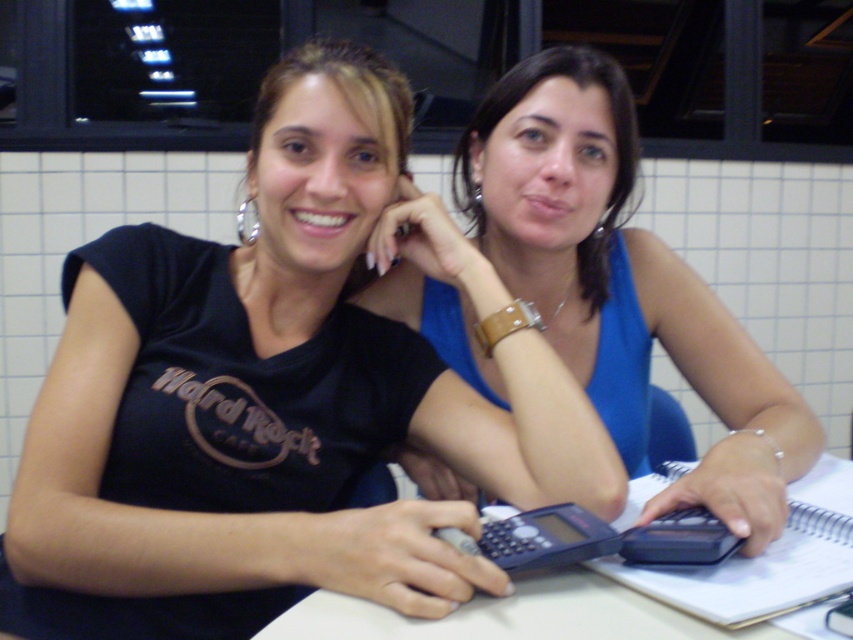
Question: Can you confirm if black matte calculator at center is thinner than spiral-bound paper at center?

Choices:
 (A) no
 (B) yes

Answer: (A)

Question: Considering the real-world distances, which object is closest to the spiral-bound paper at center?

Choices:
 (A) black matte calculator at center
 (B) white plastic table at center
 (C) blue fabric tank top at center

Answer: (B)

Question: Which object appears closest to the camera in this image?

Choices:
 (A) spiral-bound paper at center
 (B) white plastic table at center
 (C) blue fabric tank top at center
 (D) black matte calculator at center

Answer: (A)

Question: Does white plastic table at center appear on the right side of spiral-bound paper at center?

Choices:
 (A) yes
 (B) no

Answer: (B)

Question: Does black matte calculator at center appear on the left side of blue fabric tank top at center?

Choices:
 (A) yes
 (B) no

Answer: (A)

Question: Which object appears farthest from the camera in this image?

Choices:
 (A) white plastic table at center
 (B) spiral-bound paper at center
 (C) blue fabric tank top at center

Answer: (C)